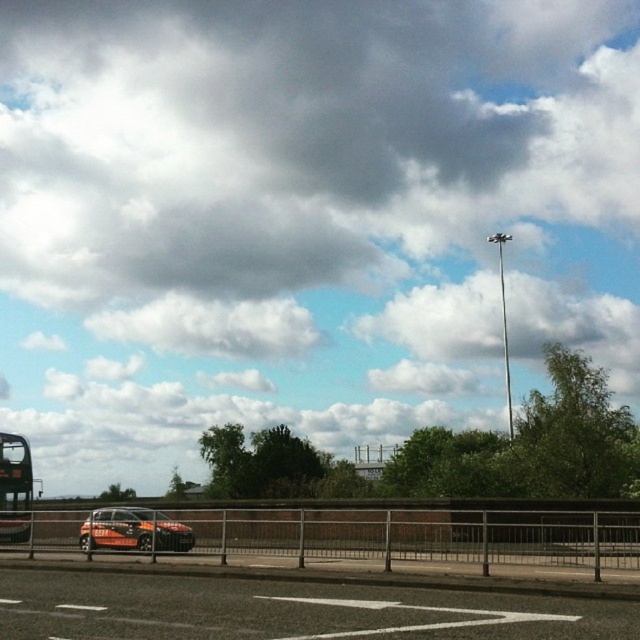
Question: Does orange matte car at lower left appear on the left side of black matte bus at left?

Choices:
 (A) yes
 (B) no

Answer: (B)

Question: Is the position of smooth asphalt highway at center less distant than that of orange matte car at lower left?

Choices:
 (A) yes
 (B) no

Answer: (A)

Question: Among these points, which one is farthest from the camera?

Choices:
 (A) (4, 449)
 (B) (202, 616)
 (C) (84, 545)

Answer: (A)

Question: Is orange matte car at lower left to the right of black matte bus at left from the viewer's perspective?

Choices:
 (A) yes
 (B) no

Answer: (A)

Question: Based on their relative distances, which object is nearer to the orange matte car at lower left?

Choices:
 (A) black matte bus at left
 (B) smooth asphalt highway at center

Answer: (B)

Question: Which object is positioned closest to the smooth asphalt highway at center?

Choices:
 (A) black matte bus at left
 (B) orange matte car at lower left

Answer: (B)